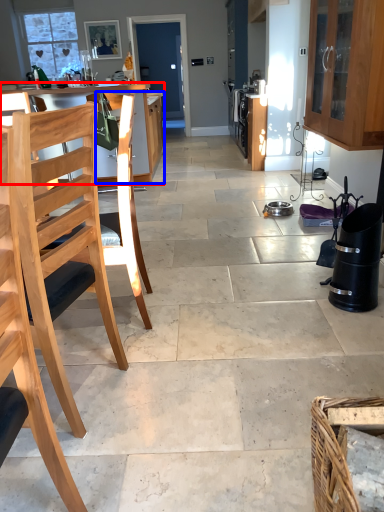
Question: Which point is closer to the camera, table (highlighted by a red box) or cabinetry (highlighted by a blue box)?

Choices:
 (A) table
 (B) cabinetry

Answer: (B)